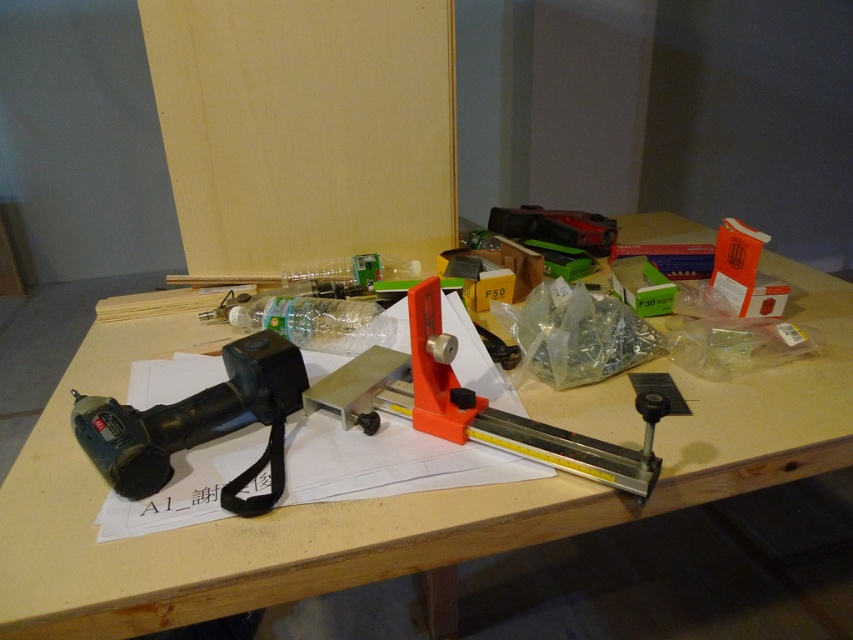
You are organizing tools on the wooden table at center and the black plastic drill at left. According to the image, which object is positioned higher relative to the other?

The wooden table at center is located above the black plastic drill at left, so the wooden table at center is higher.

You are standing in front of the workbench and want to pick up an item. Which of the two points, point [376,561] or point [281,380], is closer to you?

Point [376,561] is closer to the viewer than point [281,380].